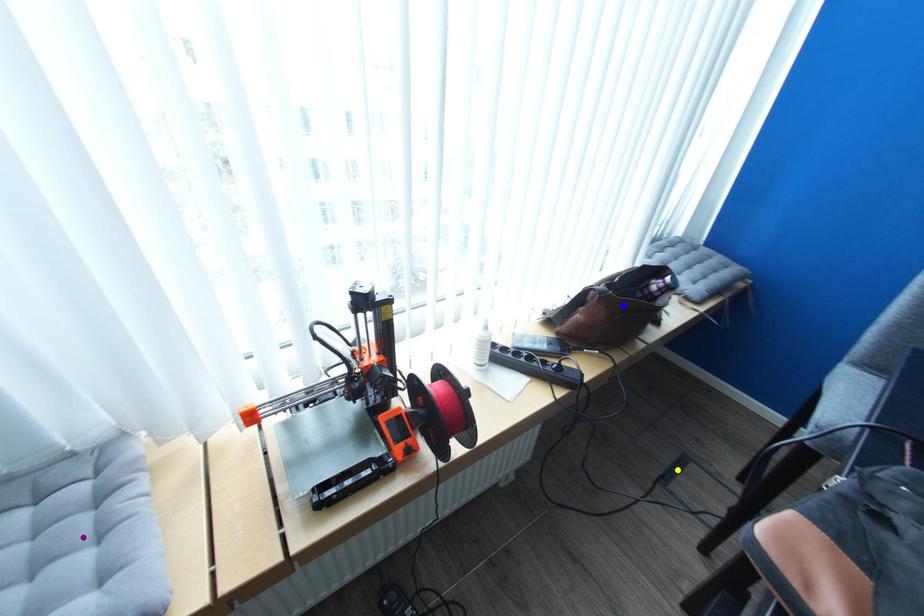
From the picture: Order these from nearest to farthest:
A) purple point
B) blue point
C) yellow point

purple point → blue point → yellow point